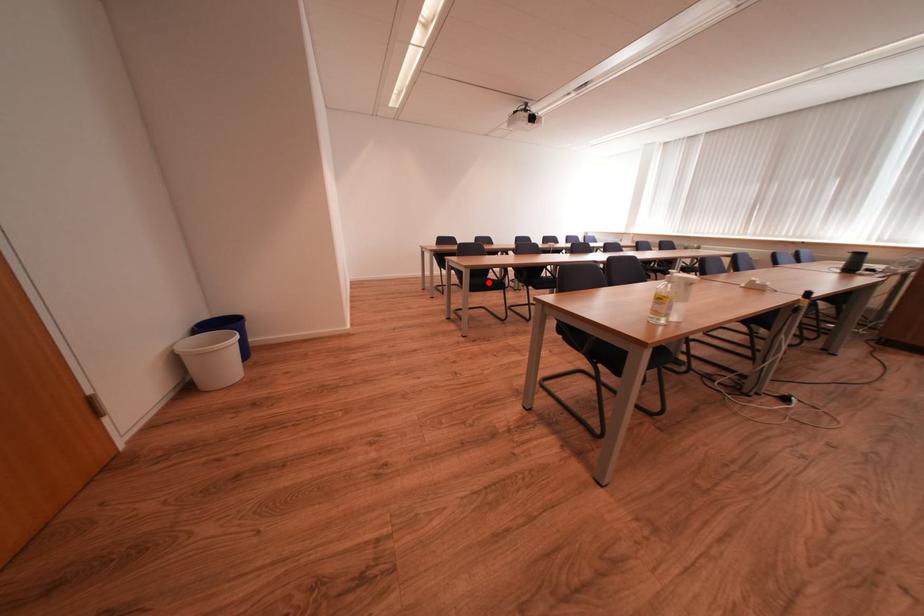
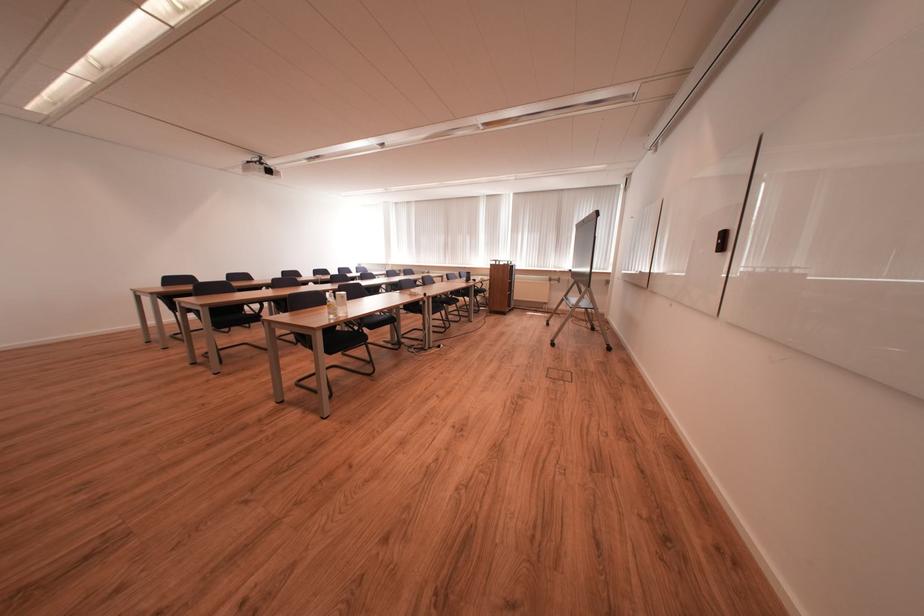
Question: A red point is marked in image1. In image2, is the corresponding 3D point closer to the camera or farther? Reply with the corresponding letter.

Choices:
 (A) The corresponding 3D point is closer.
 (B) The corresponding 3D point is farther.

Answer: (A)